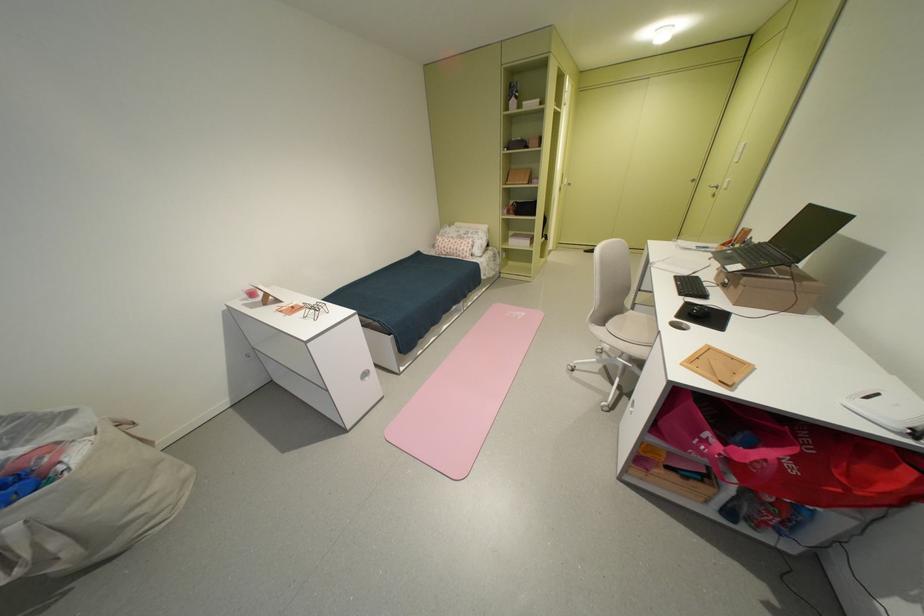
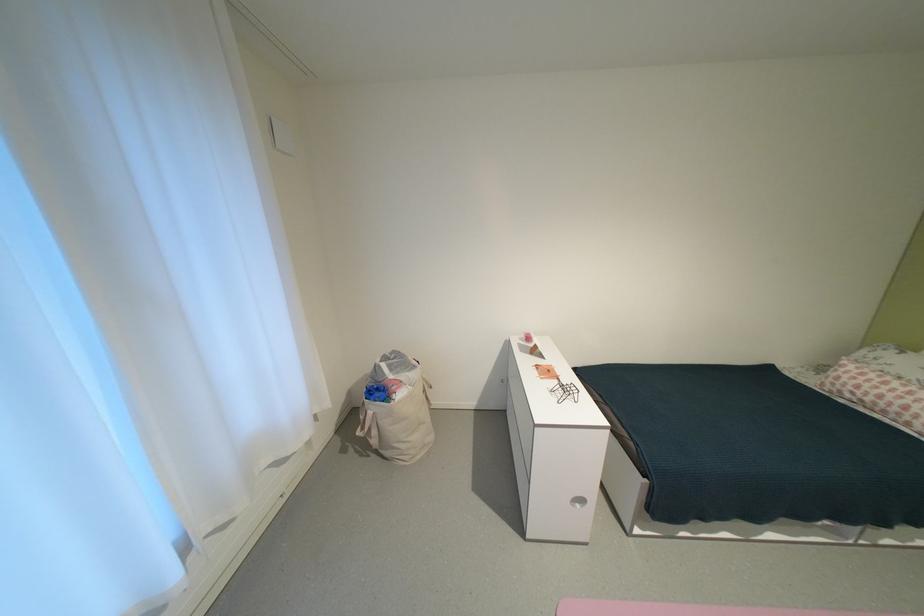
The point at [254,306] is marked in the first image. Where is the corresponding point in the second image?

(529, 346)